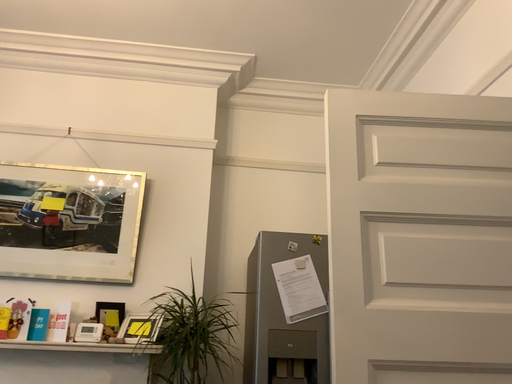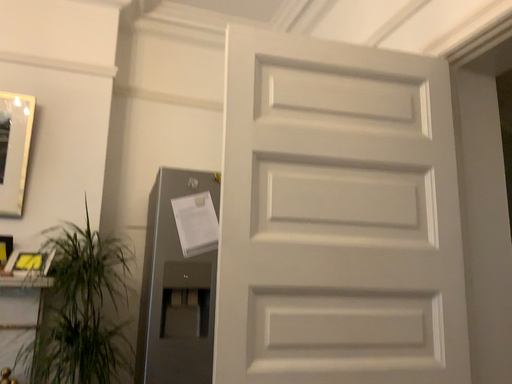
Question: Which way did the camera rotate in the video?

Choices:
 (A) rotated upward
 (B) rotated downward

Answer: (B)